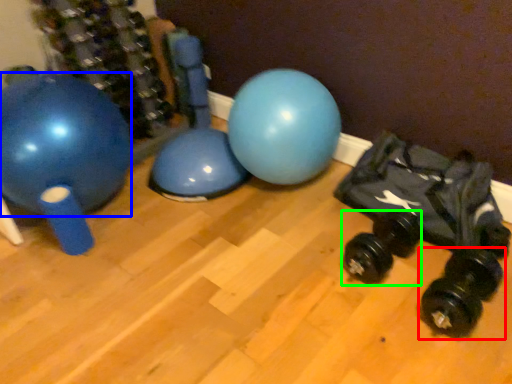
Question: Considering the real-world distances, which object is closest to dumbbell (highlighted by a red box)? ball (highlighted by a blue box) or dumbbell (highlighted by a green box).

Choices:
 (A) ball
 (B) dumbbell

Answer: (B)